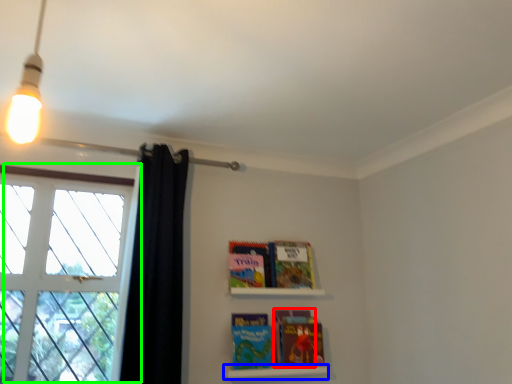
Question: Which object is positioned farthest from paperback book (highlighted by a red box)? Select from shelf (highlighted by a blue box) and window (highlighted by a green box).

Choices:
 (A) shelf
 (B) window

Answer: (B)